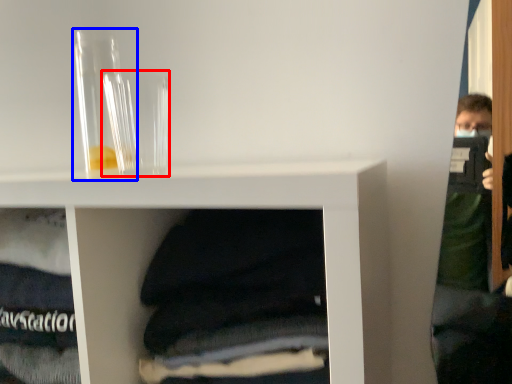
Question: Which object is further to the camera taking this photo, glass vase (highlighted by a red box) or glass vase (highlighted by a blue box)?

Choices:
 (A) glass vase
 (B) glass vase

Answer: (B)